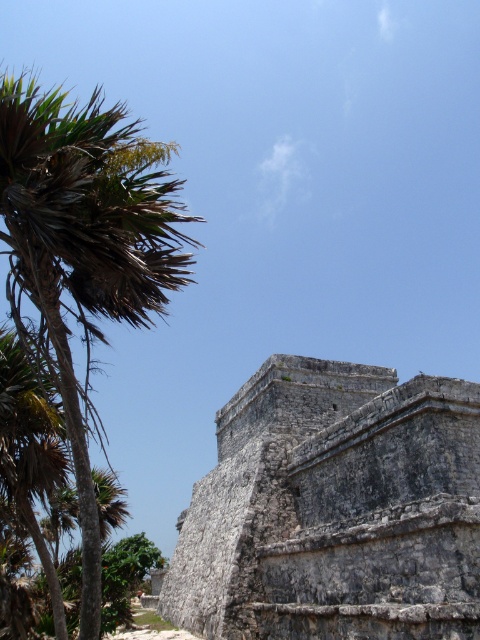
Is point (354, 401) behind point (48, 211)?

Yes, it is behind point (48, 211).

Is gray stone ruins at center in front of green leafy palm at left?

Yes, it is in front of green leafy palm at left.

At what (x,y) coordinates should I click in order to perform the action: click on gray stone ruins at center. Please return your answer as a coordinate pair (x, y). The height and width of the screenshot is (640, 480). Looking at the image, I should click on (335, 509).

Locate an element on the screen. gray stone ruins at center is located at coordinates (335, 509).